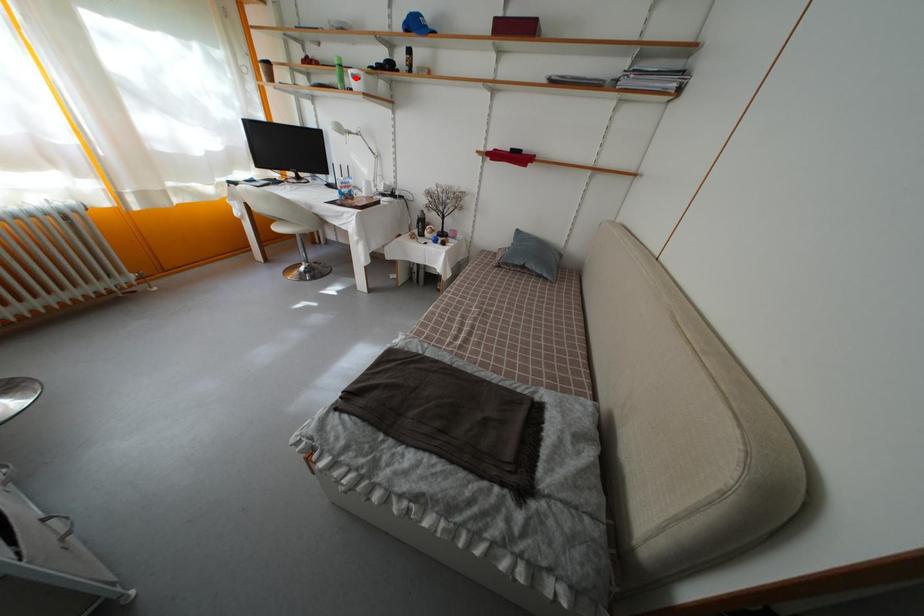
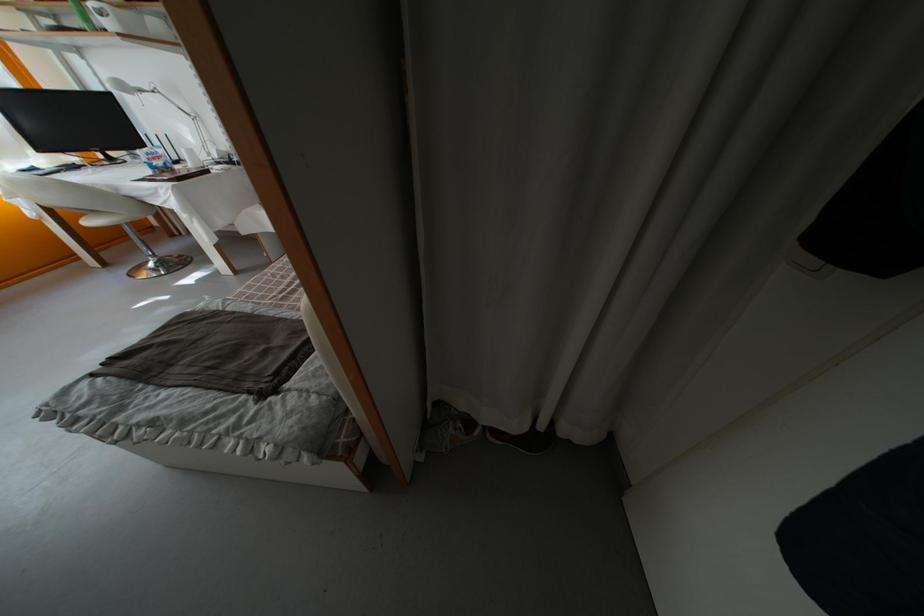
The point at the highlighted location is marked in the first image. Where is the corresponding point in the second image?

(96, 12)